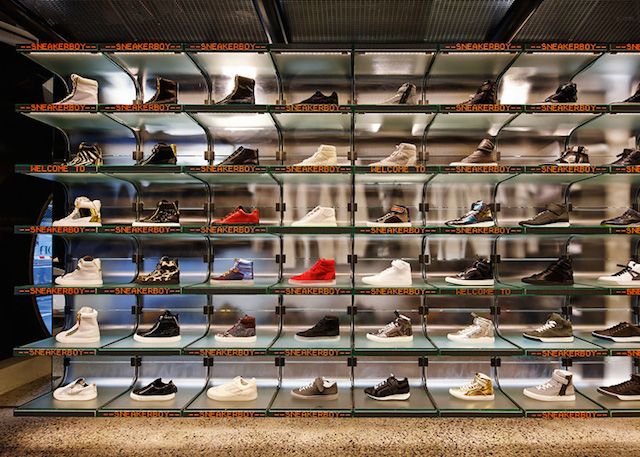
You are a GUI agent. You are given a task and a screenshot of the screen. Output one action in this format:
    pyautogui.click(x=<x>, y=<y>)
    Task: Click on the 5th shelve
    
    Given the screenshot: What is the action you would take?
    pyautogui.click(x=45, y=169), pyautogui.click(x=157, y=167), pyautogui.click(x=246, y=170), pyautogui.click(x=324, y=167), pyautogui.click(x=390, y=168), pyautogui.click(x=461, y=169), pyautogui.click(x=541, y=170), pyautogui.click(x=619, y=167)